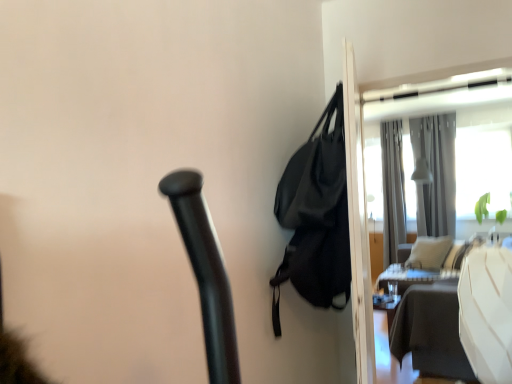
Question: Does black matte bag at upper right appear on the right side of transparent glass screen door at upper right?

Choices:
 (A) yes
 (B) no

Answer: (B)

Question: Is black matte bag at upper right further to the viewer compared to transparent glass screen door at upper right?

Choices:
 (A) yes
 (B) no

Answer: (B)

Question: Can you confirm if black matte bag at upper right is positioned to the left of transparent glass screen door at upper right?

Choices:
 (A) yes
 (B) no

Answer: (A)

Question: Is the position of black matte bag at upper right less distant than that of transparent glass screen door at upper right?

Choices:
 (A) no
 (B) yes

Answer: (B)

Question: From the image's perspective, is black matte bag at upper right under transparent glass screen door at upper right?

Choices:
 (A) no
 (B) yes

Answer: (A)

Question: Could you tell me if black matte bag at upper right is turned towards transparent glass screen door at upper right?

Choices:
 (A) no
 (B) yes

Answer: (A)

Question: Is transparent glass screen door at upper right positioned in front of silky gray curtain at upper right, positioned as the second curtain in left-to-right order?

Choices:
 (A) yes
 (B) no

Answer: (A)

Question: Is transparent glass screen door at upper right not inside silky gray curtain at upper right, acting as the 1th curtain starting from the right?

Choices:
 (A) no
 (B) yes

Answer: (B)

Question: From the image's perspective, is transparent glass screen door at upper right under silky gray curtain at upper right, positioned as the second curtain in left-to-right order?

Choices:
 (A) no
 (B) yes

Answer: (B)

Question: Could you tell me if transparent glass screen door at upper right is turned towards silky gray curtain at upper right, acting as the 1th curtain starting from the right?

Choices:
 (A) no
 (B) yes

Answer: (A)

Question: Is transparent glass screen door at upper right bigger than silky gray curtain at upper right, acting as the 1th curtain starting from the right?

Choices:
 (A) no
 (B) yes

Answer: (A)

Question: Is transparent glass screen door at upper right at the right side of silky gray curtain at upper right, acting as the 1th curtain starting from the right?

Choices:
 (A) no
 (B) yes

Answer: (A)

Question: Is gray fabric curtain at upper right, which appears as the first curtain when viewed from the left, turned away from white glossy table at right?

Choices:
 (A) no
 (B) yes

Answer: (A)